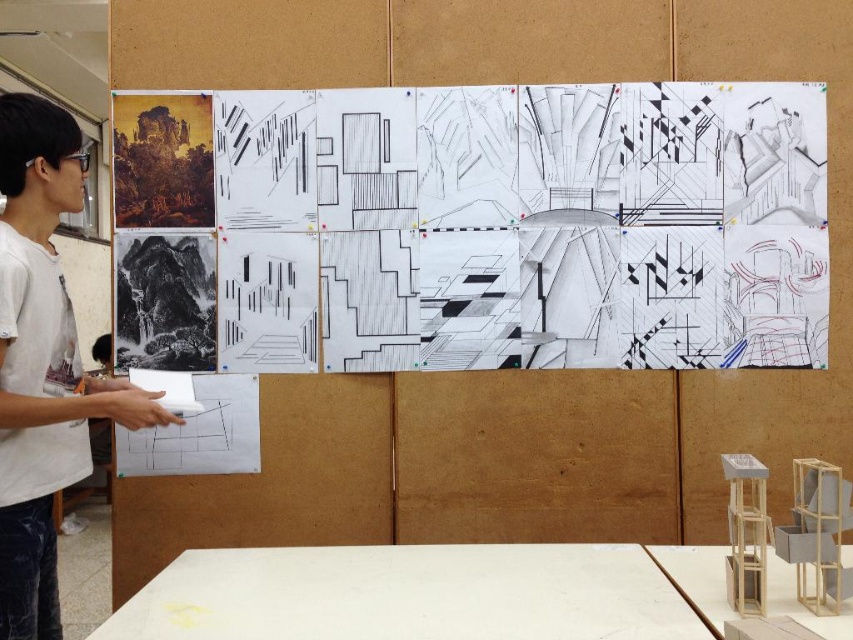
Question: Does white paper at upper center have a larger size compared to white t-shirt at left?

Choices:
 (A) yes
 (B) no

Answer: (B)

Question: Among these points, which one is farthest from the camera?

Choices:
 (A) (378, 220)
 (B) (19, 483)

Answer: (A)

Question: Is white paper at upper center bigger than white t-shirt at left?

Choices:
 (A) no
 (B) yes

Answer: (A)

Question: Is white paper at upper center bigger than white t-shirt at left?

Choices:
 (A) no
 (B) yes

Answer: (A)

Question: Which object is farther from the camera taking this photo?

Choices:
 (A) white paper at upper center
 (B) white t-shirt at left

Answer: (A)